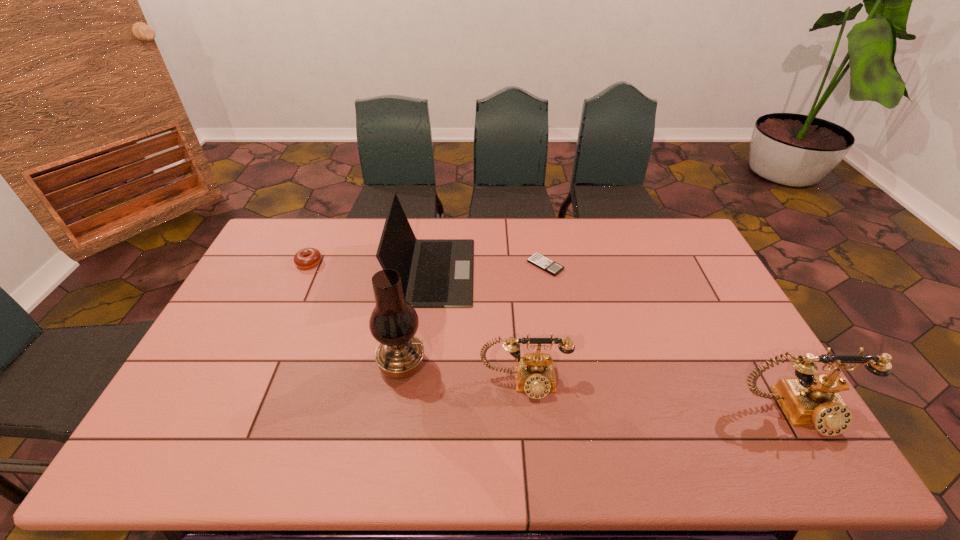
At what (x,y) coordinates should I click in order to perform the action: click on the shorter telephone. Please return your answer as a coordinate pair (x, y). This screenshot has height=540, width=960. Looking at the image, I should click on (534, 373).

Image resolution: width=960 pixels, height=540 pixels. I want to click on the left telephone, so click(x=534, y=373).

Where is `the right telephone`? Image resolution: width=960 pixels, height=540 pixels. the right telephone is located at coordinates (812, 399).

Locate an element on the screen. Image resolution: width=960 pixels, height=540 pixels. the rightmost object is located at coordinates (812, 399).

Locate an element on the screen. the shortest object is located at coordinates (538, 260).

Find the location of a particular element. The width and height of the screenshot is (960, 540). laptop is located at coordinates (434, 272).

Where is `the tallest object`? The width and height of the screenshot is (960, 540). the tallest object is located at coordinates (393, 323).

I want to click on doughnut, so click(x=308, y=257).

Identify the location of the second shortest object. (308, 257).

In order to click on vacant space located 0.060m on the dial number of the left telephone in this screenshot , I will do `click(528, 423)`.